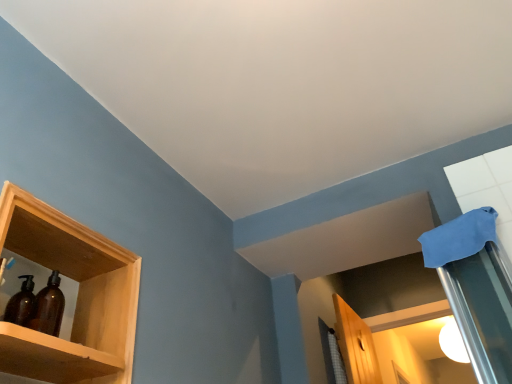
What is the approximate width of white glossy light bulb at upper right?

37.54 centimeters.

In order to face white glossy light bulb at upper right, should I rotate leftwards or rightwards?

You should look right and rotate roughly 24.285 degrees.

Locate an element on the screen. This screenshot has width=512, height=384. wooden shelf at left is located at coordinates (77, 297).

Is amber glass bottles at left in front of or behind white glossy light bulb at upper right in the image?

amber glass bottles at left is in front of white glossy light bulb at upper right.

Considering the points (55, 325) and (450, 322), which point is in front, point (55, 325) or point (450, 322)?

The point (55, 325) is in front.

What are the coordinates of `lighting that appears below the amber glass bottles at left (from the image's perspective)` in the screenshot? It's located at (453, 342).

Considering the relative positions of wooden shelf at left and white glossy light bulb at upper right in the image provided, is wooden shelf at left to the left of white glossy light bulb at upper right from the viewer's perspective?

Yes.

Identify the location of shelf in front of the white glossy light bulb at upper right. The width and height of the screenshot is (512, 384). (77, 297).

From a real-world perspective, which object rests below the other?

wooden shelf at left.

Considering the relative sizes of wooden shelf at left and white glossy light bulb at upper right in the image provided, is wooden shelf at left taller than white glossy light bulb at upper right?

In fact, wooden shelf at left may be shorter than white glossy light bulb at upper right.

Which of these two, wooden shelf at left or amber glass bottles at left, stands shorter?

amber glass bottles at left is shorter.

Is wooden shelf at left in front of or behind amber glass bottles at left in the image?

wooden shelf at left is in front of amber glass bottles at left.

Could you tell me if wooden shelf at left is turned towards amber glass bottles at left?

Yes, wooden shelf at left is aimed at amber glass bottles at left.

Can we say white glossy light bulb at upper right lies outside wooden shelf at left?

Yes.

Considering the positions of objects white glossy light bulb at upper right and wooden shelf at left in the image provided, who is in front, white glossy light bulb at upper right or wooden shelf at left?

wooden shelf at left is closer to the camera.

Can you see white glossy light bulb at upper right touching wooden shelf at left?

No.

The width and height of the screenshot is (512, 384). I want to click on lighting on the right side of wooden shelf at left, so click(x=453, y=342).

Would you consider amber glass bottles at left to be distant from wooden shelf at left?

That's not correct — amber glass bottles at left is a little close to wooden shelf at left.

Considering the sizes of objects amber glass bottles at left and wooden shelf at left in the image provided, who is smaller, amber glass bottles at left or wooden shelf at left?

Smaller between the two is amber glass bottles at left.

Locate an element on the screen. The width and height of the screenshot is (512, 384). bottle on the right of wooden shelf at left is located at coordinates (48, 307).

Can you tell me how much amber glass bottles at left and wooden shelf at left differ in facing direction?

They differ by 0.00318 degrees in their facing directions.

Measure the distance between white glossy light bulb at upper right and amber glass bottles at left.

white glossy light bulb at upper right and amber glass bottles at left are 10.92 feet apart.

The width and height of the screenshot is (512, 384). Identify the location of lighting behind the amber glass bottles at left. (453, 342).

Is white glossy light bulb at upper right next to amber glass bottles at left and touching it?

No, white glossy light bulb at upper right is not touching amber glass bottles at left.

Considering their positions, is white glossy light bulb at upper right located in front of or behind amber glass bottles at left?

white glossy light bulb at upper right is positioned farther from the viewer than amber glass bottles at left.

This screenshot has width=512, height=384. I want to click on lighting that is on the right side of amber glass bottles at left, so click(453, 342).

Locate an element on the screen. This screenshot has height=384, width=512. lighting behind the wooden shelf at left is located at coordinates (453, 342).

Looking at this image, from the image, which object appears to be nearer to white glossy light bulb at upper right, wooden shelf at left or amber glass bottles at left?

wooden shelf at left is positioned closer to the anchor white glossy light bulb at upper right.

Looking at the image, which one is located closer to wooden shelf at left, white glossy light bulb at upper right or amber glass bottles at left?

amber glass bottles at left is positioned closer to the anchor wooden shelf at left.

From the image, which object appears to be nearer to amber glass bottles at left, white glossy light bulb at upper right or wooden shelf at left?

wooden shelf at left is positioned closer to the anchor amber glass bottles at left.

Looking at this image, which object lies nearer to the anchor point white glossy light bulb at upper right, amber glass bottles at left or wooden shelf at left?

Based on the image, wooden shelf at left appears to be nearer to white glossy light bulb at upper right.

Considering their positions, is wooden shelf at left positioned closer to amber glass bottles at left than white glossy light bulb at upper right?

Based on the image, wooden shelf at left appears to be nearer to amber glass bottles at left.

Estimate the real-world distances between objects in this image. Which object is further from wooden shelf at left, amber glass bottles at left or white glossy light bulb at upper right?

white glossy light bulb at upper right is positioned further to the anchor wooden shelf at left.

Identify the location of bottle located between wooden shelf at left and white glossy light bulb at upper right in the depth direction. (48, 307).